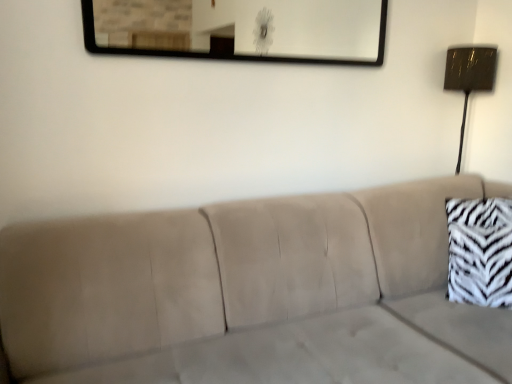
Locate an element on the screen. This screenshot has width=512, height=384. metallic gold lamp at right is located at coordinates click(x=469, y=77).

The height and width of the screenshot is (384, 512). I want to click on beige fabric couch at center, so click(x=251, y=294).

How different are the orientations of metallic gold lamp at right and metallic rectangular mirror at upper center in degrees?

The angle between the facing direction of metallic gold lamp at right and the facing direction of metallic rectangular mirror at upper center is 1.3 degrees.

In terms of height, does metallic gold lamp at right look taller or shorter compared to metallic rectangular mirror at upper center?

metallic gold lamp at right is taller than metallic rectangular mirror at upper center.

You are a GUI agent. You are given a task and a screenshot of the screen. Output one action in this format:
    pyautogui.click(x=<x>, y=<y>)
    Task: Click on the lamp behind the metallic rectangular mirror at upper center
    The image size is (512, 384).
    Given the screenshot: What is the action you would take?
    pyautogui.click(x=469, y=77)

Is metallic rectangular mirror at upper center surrounded by zebra print fabric pillow at right?

No, zebra print fabric pillow at right does not contain metallic rectangular mirror at upper center.

Which of these two, zebra print fabric pillow at right or metallic rectangular mirror at upper center, is wider?

zebra print fabric pillow at right is wider.

Looking at this image, is the depth of zebra print fabric pillow at right less than that of metallic rectangular mirror at upper center?

No, it is not.

Is beige fabric couch at center positioned with its back to zebra print fabric pillow at right?

That's not correct — beige fabric couch at center is not looking away from zebra print fabric pillow at right.

Is beige fabric couch at center wider or thinner than zebra print fabric pillow at right?

Considering their sizes, beige fabric couch at center looks broader than zebra print fabric pillow at right.

From a real-world perspective, is beige fabric couch at center above or below zebra print fabric pillow at right?

beige fabric couch at center is below zebra print fabric pillow at right.

Is beige fabric couch at center positioned in front of zebra print fabric pillow at right?

Yes.

How different are the orientations of beige fabric couch at center and metallic rectangular mirror at upper center in degrees?

They differ by 3.13 degrees in their facing directions.

Does beige fabric couch at center turn towards metallic rectangular mirror at upper center?

No, beige fabric couch at center is not turned towards metallic rectangular mirror at upper center.

You are a GUI agent. You are given a task and a screenshot of the screen. Output one action in this format:
    pyautogui.click(x=<x>, y=<y>)
    Task: Click on the mirror above the beige fabric couch at center (from the image's perspective)
    The width and height of the screenshot is (512, 384).
    Given the screenshot: What is the action you would take?
    pyautogui.click(x=240, y=29)

Is beige fabric couch at center positioned beyond the bounds of metallic gold lamp at right?

Indeed, beige fabric couch at center is completely outside metallic gold lamp at right.

In the scene shown: Is beige fabric couch at center facing towards metallic gold lamp at right?

No, beige fabric couch at center is not turned towards metallic gold lamp at right.

Is there a large distance between beige fabric couch at center and metallic gold lamp at right?

Indeed, beige fabric couch at center is not near metallic gold lamp at right.

How much distance is there between beige fabric couch at center and metallic gold lamp at right?

beige fabric couch at center is 1.25 meters away from metallic gold lamp at right.

Who is bigger, metallic rectangular mirror at upper center or metallic gold lamp at right?

metallic gold lamp at right is bigger.

Is metallic rectangular mirror at upper center oriented away from metallic gold lamp at right?

No, metallic rectangular mirror at upper center's orientation is not away from metallic gold lamp at right.

Does metallic rectangular mirror at upper center have a lesser width compared to metallic gold lamp at right?

Correct, the width of metallic rectangular mirror at upper center is less than that of metallic gold lamp at right.

Consider the image. Is zebra print fabric pillow at right with beige fabric couch at center?

They are not placed beside each other.

Is zebra print fabric pillow at right oriented towards beige fabric couch at center?

No, zebra print fabric pillow at right is not facing towards beige fabric couch at center.

Do you think zebra print fabric pillow at right is within beige fabric couch at center, or outside of it?

The correct answer is: outside.

Where is `mirror above the metallic gold lamp at right (from the image's perspective)`? The height and width of the screenshot is (384, 512). mirror above the metallic gold lamp at right (from the image's perspective) is located at coordinates (240, 29).

In the image, there is a metallic rectangular mirror at upper center. Identify the location of throw pillow below it (from the image's perspective). click(480, 251).

Which object lies nearer to the anchor point zebra print fabric pillow at right, metallic rectangular mirror at upper center or metallic gold lamp at right?

metallic gold lamp at right is closer to zebra print fabric pillow at right.

Considering their positions, is beige fabric couch at center positioned closer to zebra print fabric pillow at right than metallic rectangular mirror at upper center?

beige fabric couch at center.

Considering their positions, is zebra print fabric pillow at right positioned further to metallic gold lamp at right than beige fabric couch at center?

beige fabric couch at center.

From the picture: Based on their spatial positions, is metallic rectangular mirror at upper center or zebra print fabric pillow at right closer to metallic gold lamp at right?

zebra print fabric pillow at right is closer to metallic gold lamp at right.

Which object lies further to the anchor point beige fabric couch at center, metallic rectangular mirror at upper center or metallic gold lamp at right?

Among the two, metallic rectangular mirror at upper center is located further to beige fabric couch at center.

When comparing their distances from zebra print fabric pillow at right, does metallic gold lamp at right or beige fabric couch at center seem further?

metallic gold lamp at right.

Which object lies nearer to the anchor point metallic gold lamp at right, zebra print fabric pillow at right or metallic rectangular mirror at upper center?

zebra print fabric pillow at right is positioned closer to the anchor metallic gold lamp at right.

Looking at the image, which one is located closer to beige fabric couch at center, metallic rectangular mirror at upper center or zebra print fabric pillow at right?

zebra print fabric pillow at right.

Locate an element on the screen. Image resolution: width=512 pixels, height=384 pixels. throw pillow between metallic rectangular mirror at upper center and metallic gold lamp at right from left to right is located at coordinates (480, 251).

The height and width of the screenshot is (384, 512). What are the coordinates of `throw pillow between metallic rectangular mirror at upper center and beige fabric couch at center from top to bottom` in the screenshot? It's located at (480, 251).

Identify the location of throw pillow between beige fabric couch at center and metallic gold lamp at right in the front-back direction. This screenshot has width=512, height=384. (480, 251).

I want to click on mirror located between beige fabric couch at center and metallic gold lamp at right in the depth direction, so click(240, 29).